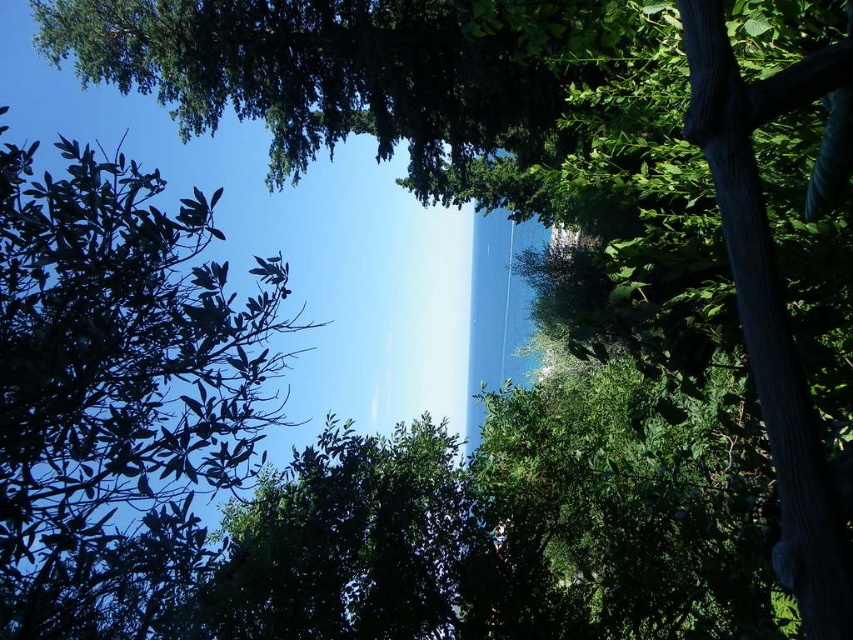
Does green leafy tree at upper left have a lesser height compared to green leafy tree at center?

Incorrect, green leafy tree at upper left's height does not fall short of green leafy tree at center's.

Does green leafy tree at upper left appear on the right side of green leafy tree at center?

In fact, green leafy tree at upper left is to the left of green leafy tree at center.

What do you see at coordinates (117, 392) in the screenshot? I see `green leafy tree at upper left` at bounding box center [117, 392].

You are a GUI agent. You are given a task and a screenshot of the screen. Output one action in this format:
    pyautogui.click(x=<x>, y=<y>)
    Task: Click on the green leafy tree at upper left
    
    Given the screenshot: What is the action you would take?
    pyautogui.click(x=117, y=392)